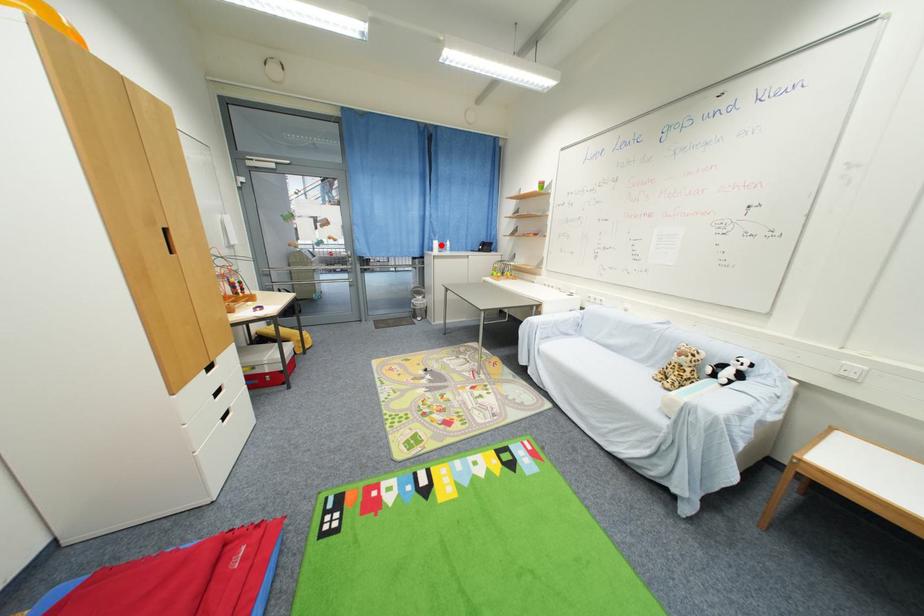
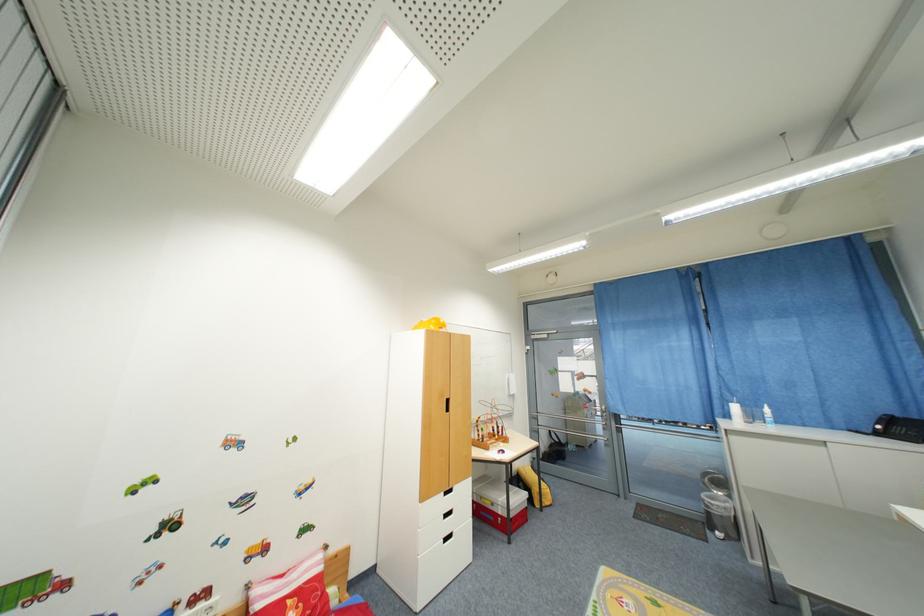
The point at the highlighted location is marked in the first image. Where is the corresponding point in the second image?

(740, 410)